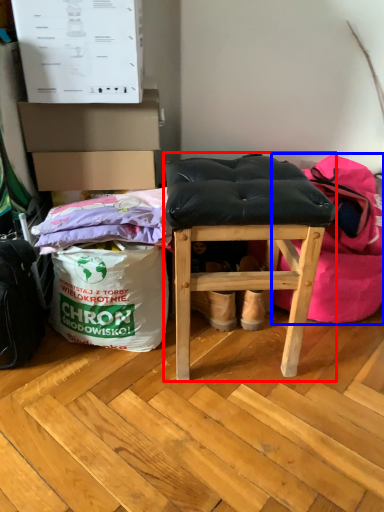
Question: Which object appears farthest to the camera in this image, furniture (highlighted by a red box) or bean bag chair (highlighted by a blue box)?

Choices:
 (A) furniture
 (B) bean bag chair

Answer: (B)